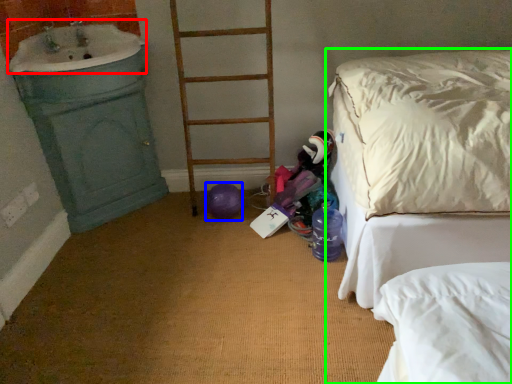
Question: Estimate the real-world distances between objects in this image. Which object is farther from sink (highlighted by a red box), balloon (highlighted by a blue box) or bed (highlighted by a green box)?

Choices:
 (A) balloon
 (B) bed

Answer: (B)